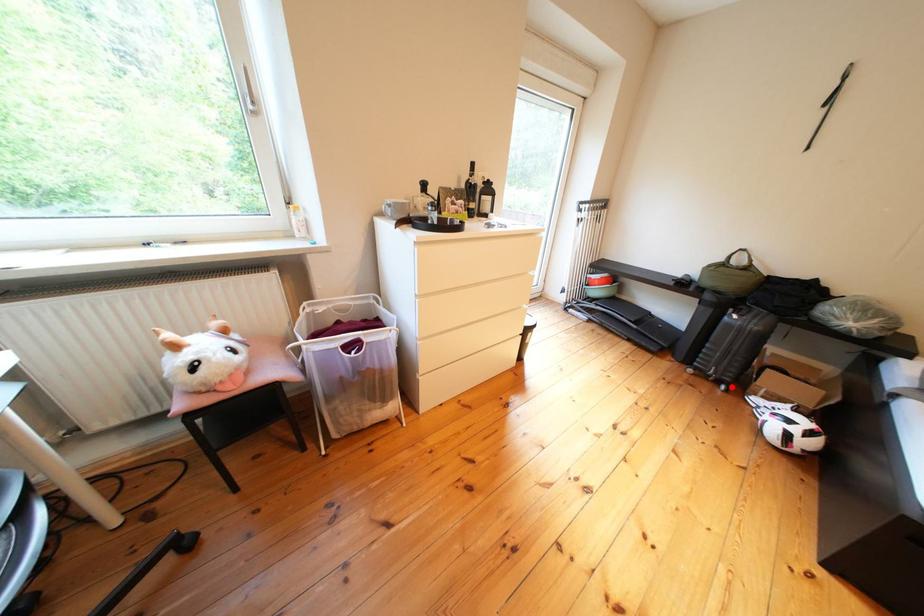
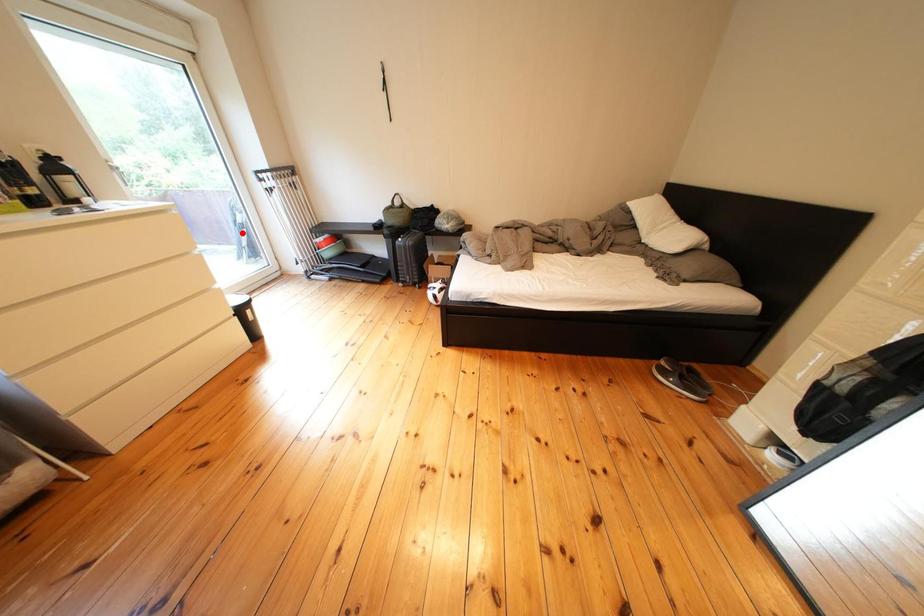
I am providing you with two images of the same scene from different viewpoints. A red point is marked on the first image and another point is marked on the second image. Is the marked point in image1 the same physical position as the marked point in image2?

No